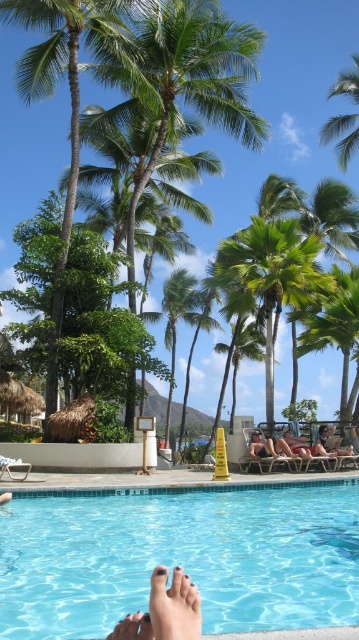
You are standing at the point with coordinates point (180, 557). Looking around, you see the blue glossy water at lower center. Which direction should you move to reach the blue glossy water at lower center?

Since you are already at the point corresponding to the blue glossy water at lower center, you don not need to move any further to reach it.

You are planning to take a photo of the blue glossy water at lower center and the green leafy palm tree at center. Which object should you focus on first if you want to capture both in one frame without moving the camera?

The blue glossy water at lower center should be focused on first because it occupies less space than the green leafy palm tree at center, allowing more room to include both in the frame.